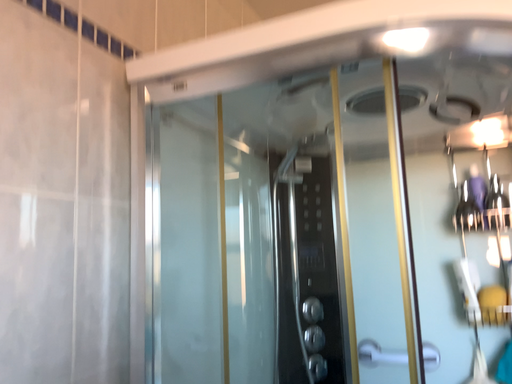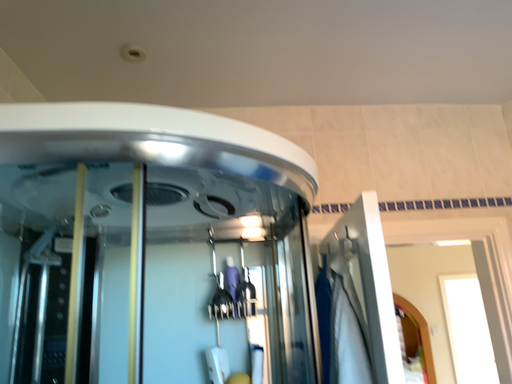
Question: How did the camera likely rotate when shooting the video?

Choices:
 (A) rotated left
 (B) rotated right

Answer: (B)